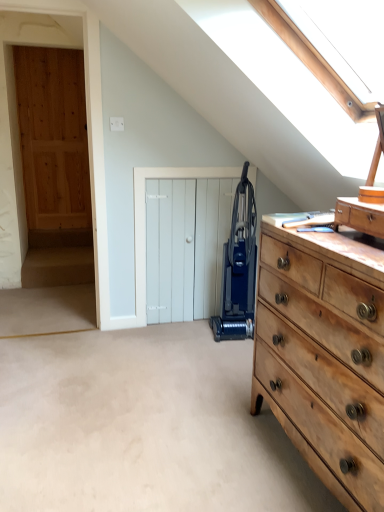
Locate an element on the screen. free space above white wooden door at center (from a real-world perspective) is located at coordinates [x=198, y=163].